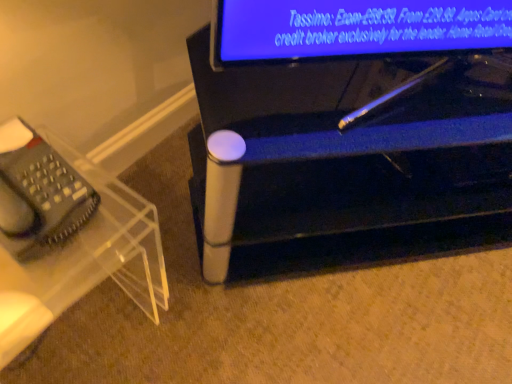
Question: Is clear plastic telephone at left further to camera compared to metallic silver pen at lower center, marked as the second furniture in a left-to-right arrangement?

Choices:
 (A) yes
 (B) no

Answer: (B)

Question: Does clear plastic telephone at left have a larger size compared to metallic silver pen at lower center, the 1th furniture from the right?

Choices:
 (A) no
 (B) yes

Answer: (A)

Question: Could you tell me if clear plastic telephone at left is turned towards metallic silver pen at lower center, the 1th furniture from the right?

Choices:
 (A) yes
 (B) no

Answer: (B)

Question: Considering the relative sizes of clear plastic telephone at left and metallic silver pen at lower center, marked as the second furniture in a left-to-right arrangement, in the image provided, is clear plastic telephone at left taller than metallic silver pen at lower center, marked as the second furniture in a left-to-right arrangement,?

Choices:
 (A) yes
 (B) no

Answer: (B)

Question: Does clear plastic telephone at left have a smaller size compared to metallic silver pen at lower center, marked as the second furniture in a left-to-right arrangement?

Choices:
 (A) no
 (B) yes

Answer: (B)

Question: Which is correct: clear plastic telephone at left is inside metallic silver pen at lower center, the 1th furniture from the right, or outside of it?

Choices:
 (A) outside
 (B) inside

Answer: (A)

Question: Visually, is clear plastic telephone at left positioned to the left or to the right of metallic silver pen at lower center, marked as the second furniture in a left-to-right arrangement?

Choices:
 (A) left
 (B) right

Answer: (A)

Question: In the image, is clear plastic telephone at left positioned in front of or behind metallic silver pen at lower center, the 1th furniture from the right?

Choices:
 (A) front
 (B) behind

Answer: (A)

Question: From the image's perspective, is clear plastic telephone at left positioned above or below metallic silver pen at lower center, the 1th furniture from the right?

Choices:
 (A) above
 (B) below

Answer: (B)

Question: From their relative heights in the image, would you say transparent acrylic phone stand at left, arranged as the 2th furniture when viewed from the right, is taller or shorter than clear plastic telephone at left?

Choices:
 (A) tall
 (B) short

Answer: (A)

Question: From a real-world perspective, is transparent acrylic phone stand at left, arranged as the 2th furniture when viewed from the right, above or below clear plastic telephone at left?

Choices:
 (A) above
 (B) below

Answer: (B)

Question: Looking at their shapes, would you say transparent acrylic phone stand at left, arranged as the 2th furniture when viewed from the right, is wider or thinner than clear plastic telephone at left?

Choices:
 (A) wide
 (B) thin

Answer: (A)

Question: From the image's perspective, is transparent acrylic phone stand at left, arranged as the 2th furniture when viewed from the right, above or below clear plastic telephone at left?

Choices:
 (A) below
 (B) above

Answer: (A)

Question: Is metallic silver pen at lower center, marked as the second furniture in a left-to-right arrangement, situated inside transparent acrylic phone stand at left, arranged as the 2th furniture when viewed from the right, or outside?

Choices:
 (A) inside
 (B) outside

Answer: (B)

Question: In terms of size, does metallic silver pen at lower center, marked as the second furniture in a left-to-right arrangement, appear bigger or smaller than transparent acrylic phone stand at left, arranged as the 2th furniture when viewed from the right?

Choices:
 (A) small
 (B) big

Answer: (B)